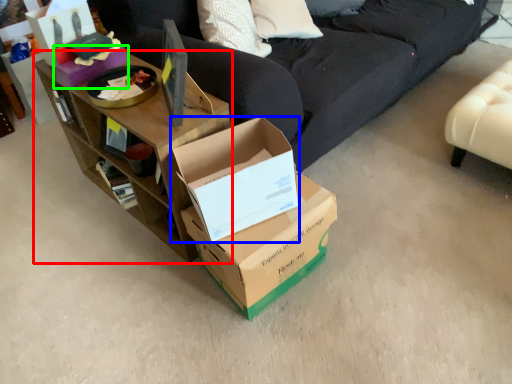
Question: Which is farther away from shelf (highlighted by a red box)? box (highlighted by a blue box) or box (highlighted by a green box)?

Choices:
 (A) box
 (B) box

Answer: (B)